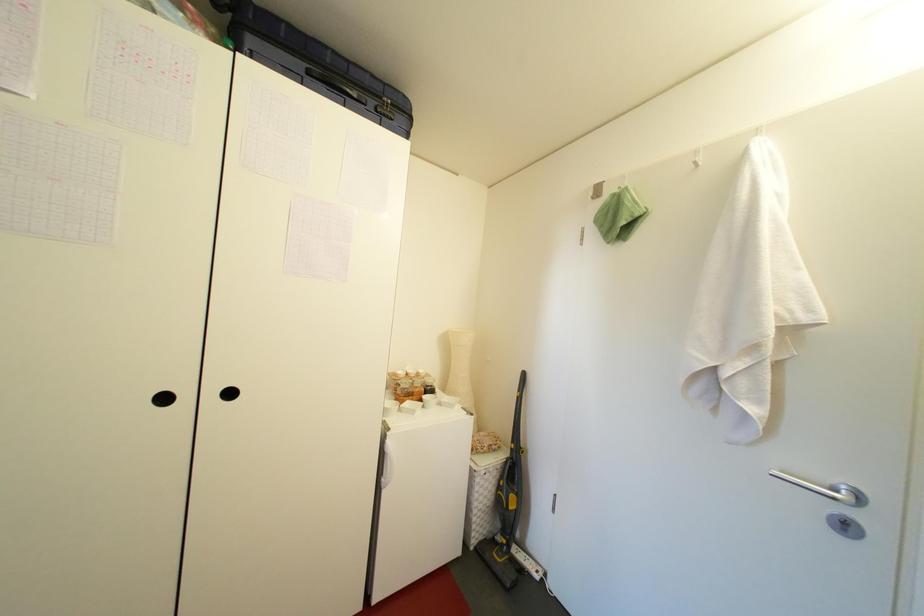
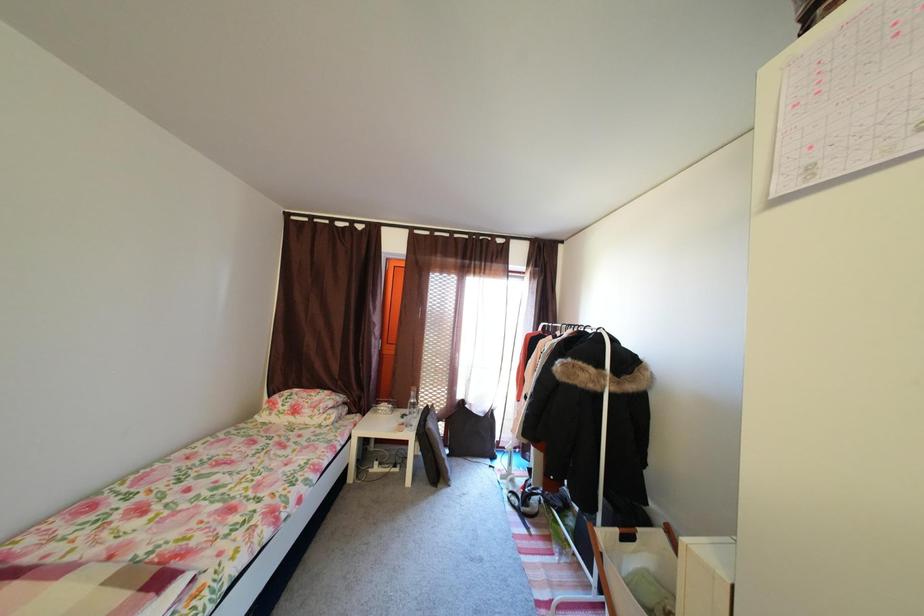
Question: The camera is either moving clockwise (left) or counter-clockwise (right) around the object. The first image is from the beginning of the video and the second image is from the end. Is the camera moving left or right when shooting the video?

Choices:
 (A) Left
 (B) Right

Answer: (B)